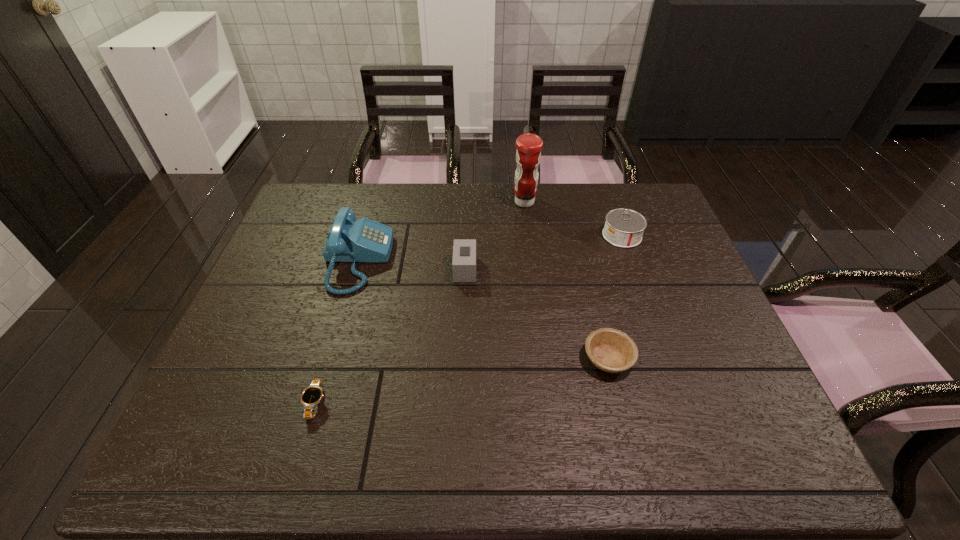
Image resolution: width=960 pixels, height=540 pixels. What are the coordinates of `free space between the farthest object and the can` in the screenshot? It's located at (573, 219).

This screenshot has height=540, width=960. What are the coordinates of `free space between the telephone and the watch` in the screenshot? It's located at (337, 332).

Find the location of a particular element. This screenshot has height=540, width=960. free area in between the rightmost object and the bowl is located at coordinates (615, 297).

Locate an element on the screen. free space between the third object from left to right and the bowl is located at coordinates (537, 314).

I want to click on free area in between the fifth tallest object and the shortest object, so click(x=462, y=381).

Find the location of a particular element. blank region between the watch and the condiment is located at coordinates (420, 302).

Locate an element on the screen. unoccupied area between the alarm clock and the second shortest object is located at coordinates (537, 314).

Locate which object is the fourth closest to the tallest object. Please provide its 2D coordinates. Your answer should be formatted as a tuple, i.e. [(x, y)], where the tuple contains the x and y coordinates of a point satisfying the conditions above.

[(611, 350)]

Where is `object identified as the second closest to the fourth object from right to left`? The height and width of the screenshot is (540, 960). object identified as the second closest to the fourth object from right to left is located at coordinates coord(528,155).

Locate an element on the screen. vacant region that satisfies the following two spatial constraints: 1. on the dial of the telephone; 2. on the left side of the bowl is located at coordinates (329, 359).